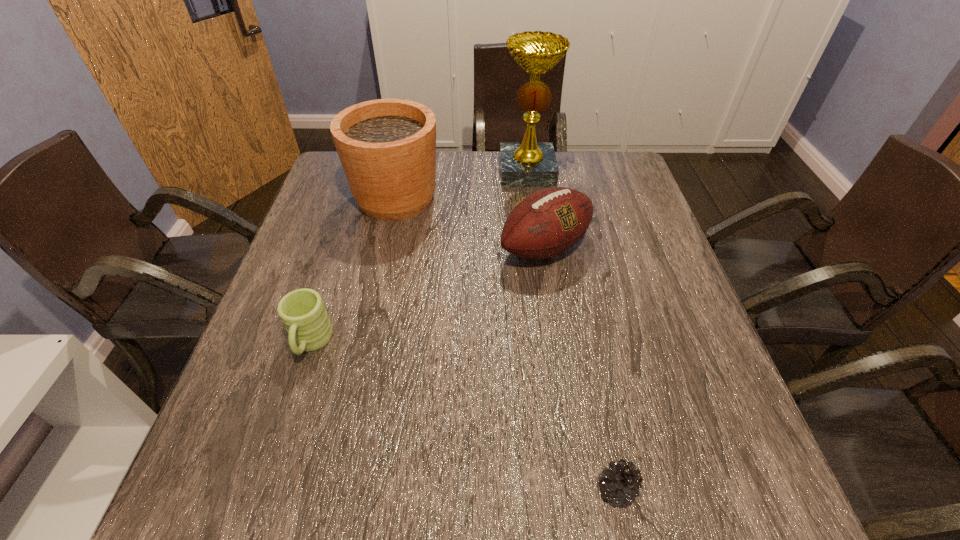
Identify which object is the closest to the second tallest object. Please provide its 2D coordinates. Your answer should be formatted as a tuple, i.e. [(x, y)], where the tuple contains the x and y coordinates of a point satisfying the conditions above.

[(548, 222)]

Find the location of a particular element. The image size is (960, 540). object identified as the closest to the fourth farthest object is located at coordinates (387, 147).

This screenshot has height=540, width=960. I want to click on vacant space that satisfies the following two spatial constraints: 1. on the front-facing side of the nearest object; 2. on the left side of the tallest object, so click(x=569, y=489).